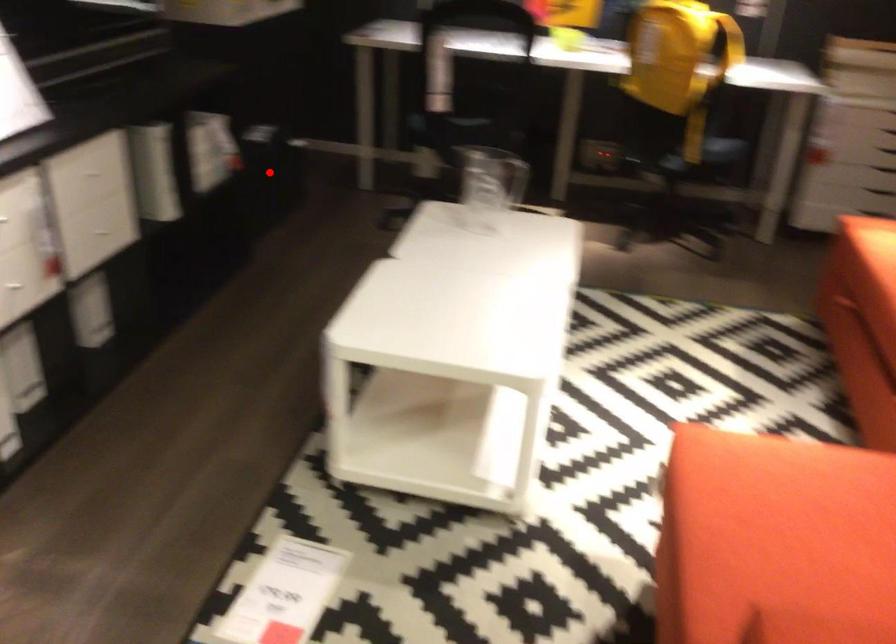
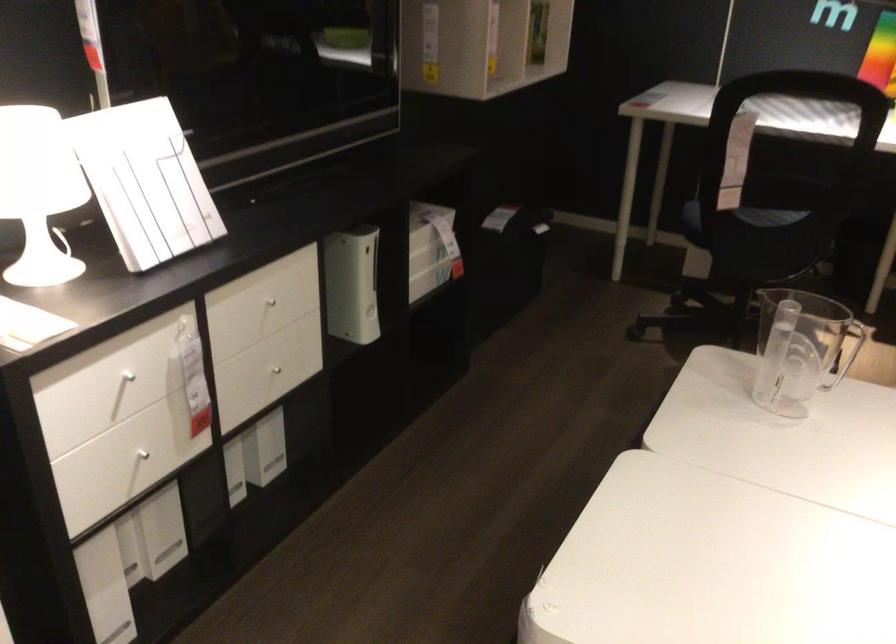
Question: I am providing you with two images of the same scene from different viewpoints. In image1, a red point is highlighted. Considering the same 3D point in image2, which of the following is correct?

Choices:
 (A) It is closer
 (B) It is farther

Answer: (A)